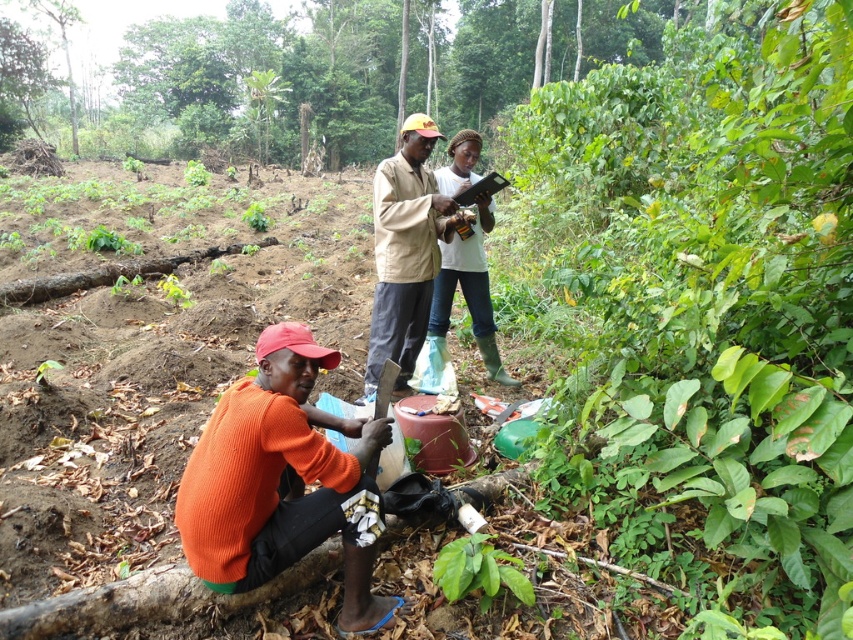
You are a researcher standing at the edge of the forest and see the white matte shirt at center and the green leafy plant at lower center. You need to collect a sample from the plant. Can you reach it with a 2 meter long tool without moving closer?

The white matte shirt at center is 2.15 meters away from the green leafy plant at lower center. Since the tool is only 2 meters long, you cannot reach the plant without moving closer.

Based on the scene description, is the green leafy plant at lower center located in front of or behind the beige fabric shirt at center?

The green leafy plant at lower center is behind the beige fabric shirt at center, so it is located behind.